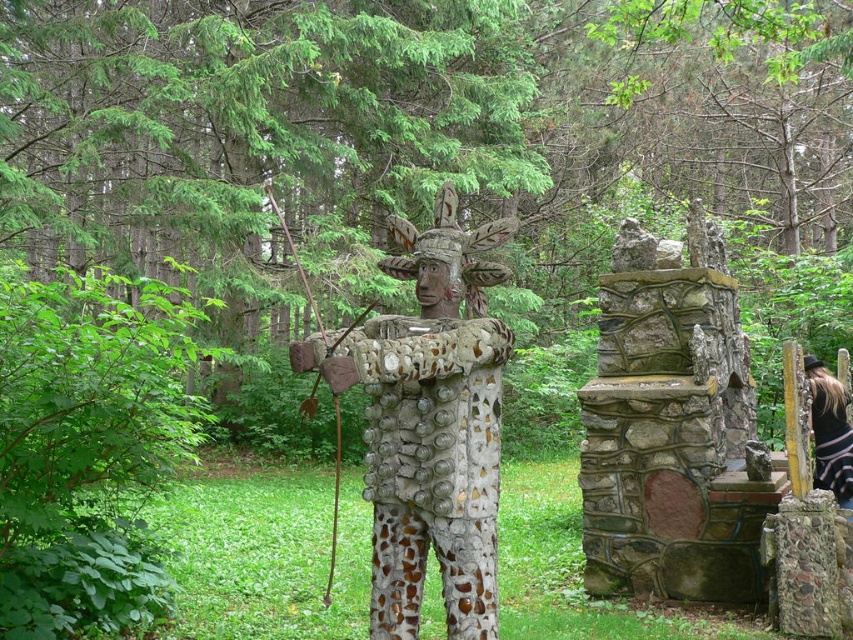
Between point (451, 451) and point (828, 486), which one is positioned behind?

Point (828, 486)

Is point (426, 259) positioned behind point (817, 470)?

That is False.

Is point (433, 417) positioned before point (815, 387)?

Yes.

Where is `polished stone statue at center`? This screenshot has width=853, height=640. polished stone statue at center is located at coordinates (428, 422).